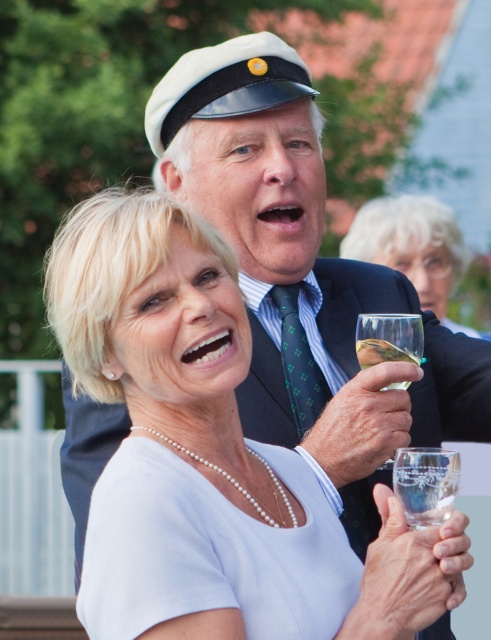
Question: Considering the real-world distances, which object is closest to the clear glass wine glass at right?

Choices:
 (A) clear glass wine at right
 (B) clear glass at center

Answer: (A)

Question: Does clear glass at center come behind clear glass wine at right?

Choices:
 (A) no
 (B) yes

Answer: (A)

Question: Can you confirm if transparent glass at upper center is wider than clear glass at center?

Choices:
 (A) yes
 (B) no

Answer: (A)

Question: Which of the following is the farthest from the observer?

Choices:
 (A) clear glass wine glass at right
 (B) transparent glass at upper center
 (C) clear glass at center

Answer: (B)

Question: Is clear glass at center wider than clear glass at lower right?

Choices:
 (A) yes
 (B) no

Answer: (B)

Question: Among these points, which one is farthest from the camera?

Choices:
 (A) (439, 496)
 (B) (413, 332)
 (C) (451, 257)
 (D) (366, 346)

Answer: (C)